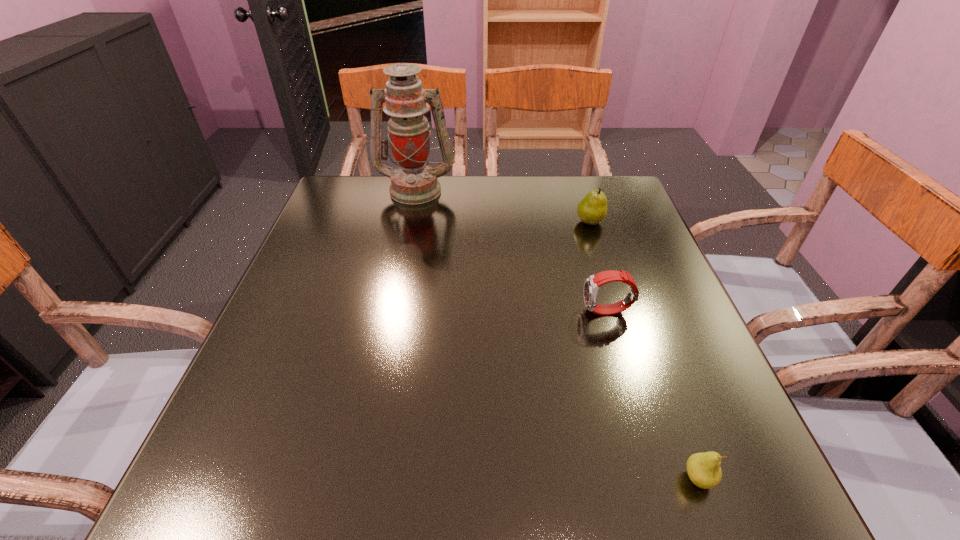
This screenshot has height=540, width=960. Find the location of `free space between the watch and the farthest object`. free space between the watch and the farthest object is located at coordinates (512, 251).

What are the coordinates of `free space between the nearer pear and the watch` in the screenshot? It's located at (653, 395).

I want to click on vacant area that lies between the watch and the second farthest object, so click(x=599, y=267).

The height and width of the screenshot is (540, 960). Identify the location of free space between the nearer pear and the third nearest object. (644, 350).

Identify the location of free space between the nearer pear and the second nearest object. Image resolution: width=960 pixels, height=540 pixels. (653, 395).

Locate an element on the screen. The image size is (960, 540). vacant space that is in between the farthest object and the third nearest object is located at coordinates (503, 206).

Identify which object is located as the third nearest to the farther pear. Please provide its 2D coordinates. Your answer should be formatted as a tuple, i.e. [(x, y)], where the tuple contains the x and y coordinates of a point satisfying the conditions above.

[(703, 469)]

Select which object is the third closest to the third farthest object. Please provide its 2D coordinates. Your answer should be formatted as a tuple, i.e. [(x, y)], where the tuple contains the x and y coordinates of a point satisfying the conditions above.

[(414, 182)]

This screenshot has width=960, height=540. Find the location of `blank area in the image that satisfies the following two spatial constraints: 1. on the front side of the third nearest object; 2. on the face of the second nearest object`. blank area in the image that satisfies the following two spatial constraints: 1. on the front side of the third nearest object; 2. on the face of the second nearest object is located at coordinates (619, 312).

Where is `free region that satisfies the following two spatial constraints: 1. on the face of the third farthest object; 2. on the left side of the nearest object`? The image size is (960, 540). free region that satisfies the following two spatial constraints: 1. on the face of the third farthest object; 2. on the left side of the nearest object is located at coordinates (657, 478).